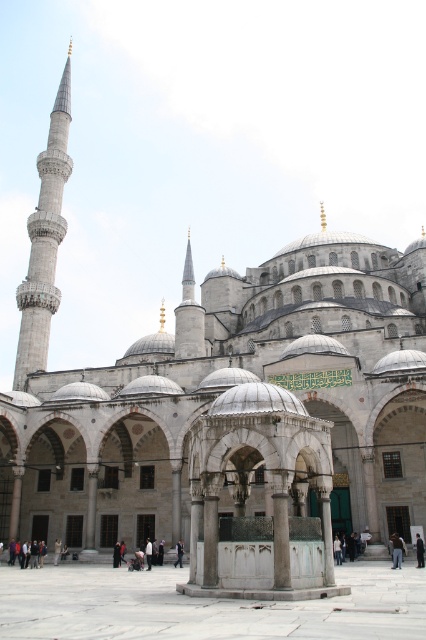
Question: Is the position of brown leather jacket at lower right less distant than that of black suit at center?

Choices:
 (A) yes
 (B) no

Answer: (B)

Question: Estimate the real-world distances between objects in this image. Which object is closer to the white marble fountain at center?

Choices:
 (A) brown leather jacket at lower right
 (B) gray stone minaret at left
 (C) light brown leather jacket at lower left
 (D) black suit at center

Answer: (A)

Question: Considering the relative positions of black suit at center and light brown leather jacket at lower left in the image provided, where is black suit at center located with respect to light brown leather jacket at lower left?

Choices:
 (A) below
 (B) above

Answer: (B)

Question: Estimate the real-world distances between objects in this image. Which object is closer to the black suit at center?

Choices:
 (A) light brown leather jacket at lower left
 (B) brown leather jacket at lower right
 (C) dark gray fabric person at center

Answer: (B)

Question: Observing the image, what is the correct spatial positioning of brown leather jacket at lower right in reference to light brown leather jacket at lower left?

Choices:
 (A) below
 (B) above

Answer: (B)

Question: Which object appears closest to the camera in this image?

Choices:
 (A) light brown leather jacket at lower left
 (B) gray stone minaret at left

Answer: (A)